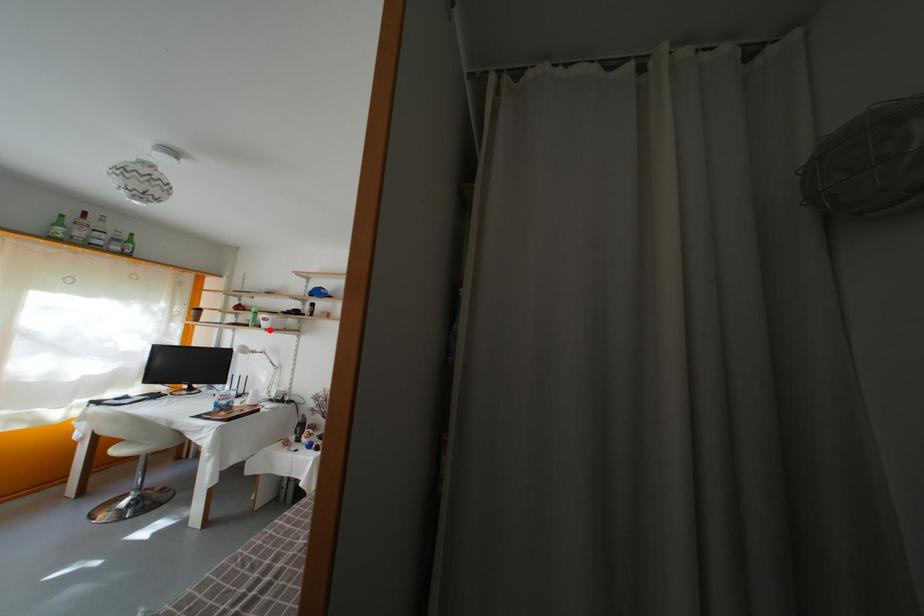
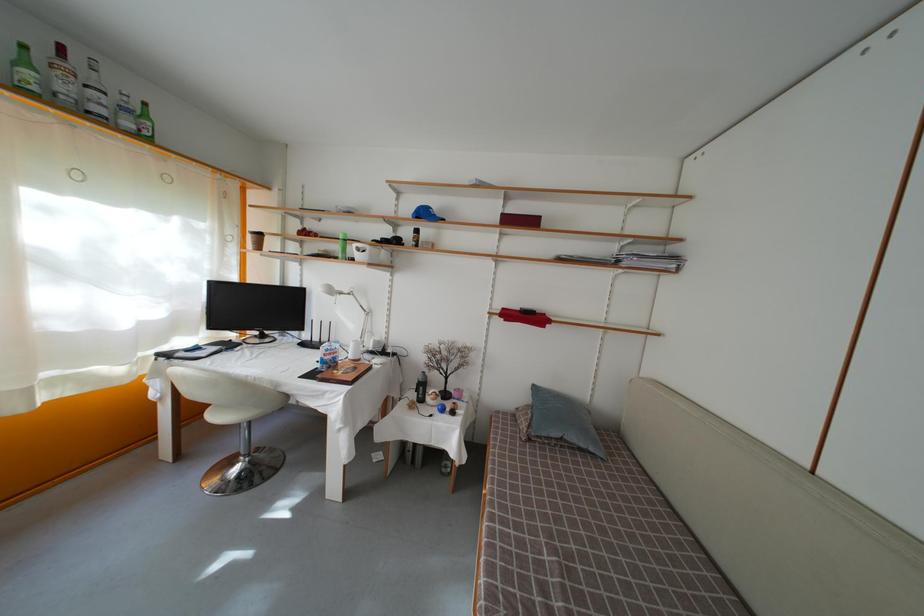
Question: I am providing you with two images of the same scene from different viewpoints. A red point is marked on the first image. At the location where the point appears in image 1, is it still visible in image 2?

Choices:
 (A) Yes
 (B) No

Answer: (A)